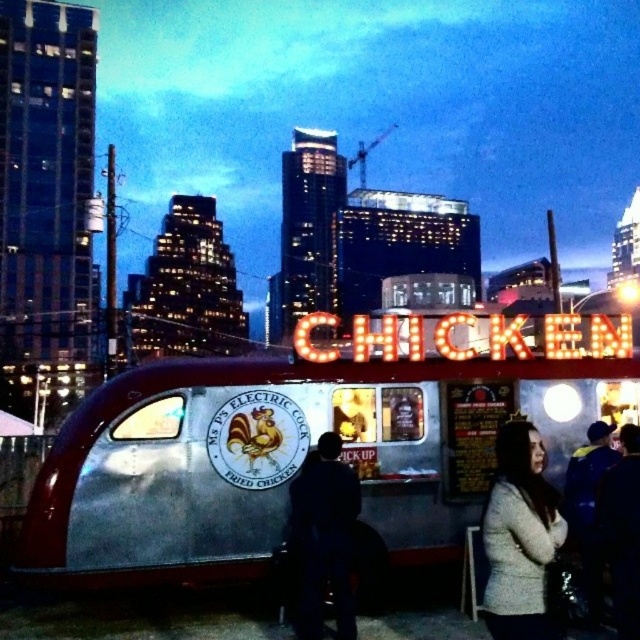
You are a photographer trying to capture the neon sign of the silver metallic food truck at center. However, there is a dark fabric jacket at center blocking your view. Can you move the jacket to the front of the truck to get a clear shot of the sign?

The dark fabric jacket at center is behind the silver metallic food truck at center, so it is already positioned in a way that does not block the view of the truck. Therefore, you don not need to move the jacket to take the photo.

You are standing in front of the food truck and want to reach both the point at coordinates [595,356] and the point at [349,632]. Which point will you reach first as you walk towards them?

You will reach the point at coordinates [595,356] first because it is closer to you than the point at [349,632], which is further away.